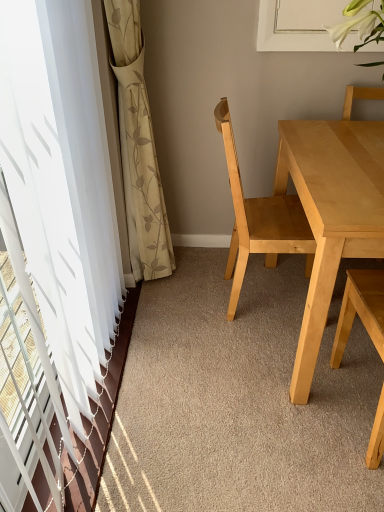
Question: Could you tell me if light wood table at center is turned towards white sheer curtain at left?

Choices:
 (A) yes
 (B) no

Answer: (B)

Question: Considering the relative sizes of light wood table at center and white sheer curtain at left in the image provided, is light wood table at center wider than white sheer curtain at left?

Choices:
 (A) yes
 (B) no

Answer: (A)

Question: Is light wood table at center shorter than white sheer curtain at left?

Choices:
 (A) yes
 (B) no

Answer: (A)

Question: From a real-world perspective, does light wood table at center stand above white sheer curtain at left?

Choices:
 (A) no
 (B) yes

Answer: (A)

Question: Can you confirm if light wood table at center is taller than white sheer curtain at left?

Choices:
 (A) no
 (B) yes

Answer: (A)

Question: From a real-world perspective, is light wood chair at center, the 2th chair in the right-to-left sequence, positioned above or below beige floral fabric curtain at left?

Choices:
 (A) below
 (B) above

Answer: (A)

Question: Would you say light wood chair at center, the 2th chair in the right-to-left sequence, is to the left or to the right of beige floral fabric curtain at left in the picture?

Choices:
 (A) left
 (B) right

Answer: (B)

Question: Considering the positions of light wood chair at center, the first chair in the left-to-right sequence, and beige floral fabric curtain at left in the image, is light wood chair at center, the first chair in the left-to-right sequence, taller or shorter than beige floral fabric curtain at left?

Choices:
 (A) short
 (B) tall

Answer: (A)

Question: From the image's perspective, is light wood chair at center, the first chair in the left-to-right sequence, above or below beige floral fabric curtain at left?

Choices:
 (A) above
 (B) below

Answer: (B)

Question: In the image, is white sheer curtain at left positioned in front of or behind light wood table at center?

Choices:
 (A) front
 (B) behind

Answer: (A)

Question: Is white sheer curtain at left situated inside light wood table at center or outside?

Choices:
 (A) outside
 (B) inside

Answer: (A)

Question: From the image's perspective, is white sheer curtain at left located above or below light wood table at center?

Choices:
 (A) above
 (B) below

Answer: (B)

Question: Considering the positions of white sheer curtain at left and light wood table at center in the image, is white sheer curtain at left taller or shorter than light wood table at center?

Choices:
 (A) tall
 (B) short

Answer: (A)

Question: Looking at the image, does light wood chair at right, the 2th chair viewed from the left, seem bigger or smaller compared to light wood chair at center, the first chair in the left-to-right sequence?

Choices:
 (A) small
 (B) big

Answer: (A)

Question: From the image's perspective, is light wood chair at right, the first chair viewed from the right, above or below light wood chair at center, the 2th chair in the right-to-left sequence?

Choices:
 (A) below
 (B) above

Answer: (A)